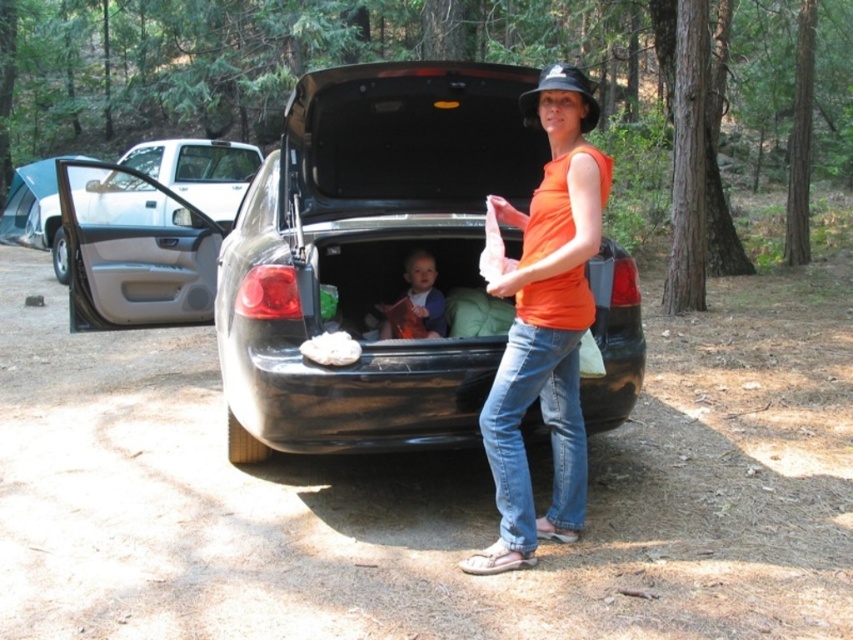
The height and width of the screenshot is (640, 853). What are the coordinates of `shiny black car at center` in the screenshot? It's located at (368, 253).

Can you confirm if shiny black car at center is positioned to the right of smooth plastic book at center?

No, shiny black car at center is not to the right of smooth plastic book at center.

Who is more forward, (294, 440) or (410, 262)?

Point (294, 440) is more forward.

Locate an element on the screen. This screenshot has width=853, height=640. shiny black car at center is located at coordinates (368, 253).

Describe the element at coordinates (544, 324) in the screenshot. The image size is (853, 640). I see `orange cotton tank top at center` at that location.

Is orange cotton tank top at center below smooth plastic book at center?

Yes, orange cotton tank top at center is below smooth plastic book at center.

Which is in front, point (572, 81) or point (381, 324)?

Point (572, 81)

Locate an element on the screen. orange cotton tank top at center is located at coordinates (544, 324).

Is shiny black car at center to the left of orange cotton tank top at center from the viewer's perspective?

Indeed, shiny black car at center is positioned on the left side of orange cotton tank top at center.

Between shiny black car at center and orange cotton tank top at center, which one is positioned higher?

Positioned higher is shiny black car at center.

At what (x,y) coordinates should I click in order to perform the action: click on shiny black car at center. Please return your answer as a coordinate pair (x, y). Looking at the image, I should click on (368, 253).

Locate an element on the screen. This screenshot has width=853, height=640. shiny black car at center is located at coordinates (368, 253).